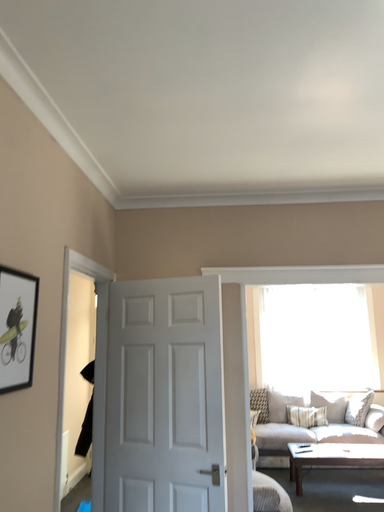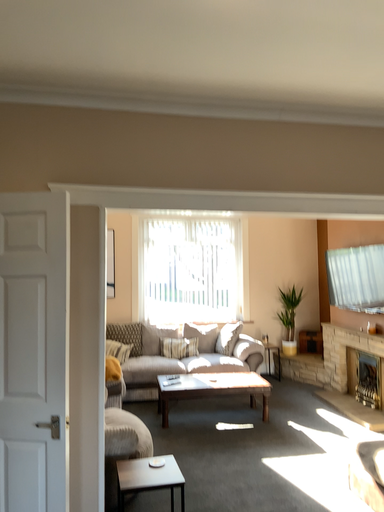
Question: Which way did the camera rotate in the video?

Choices:
 (A) rotated downward
 (B) rotated upward

Answer: (A)